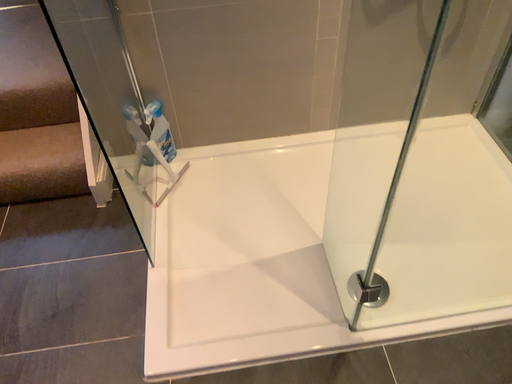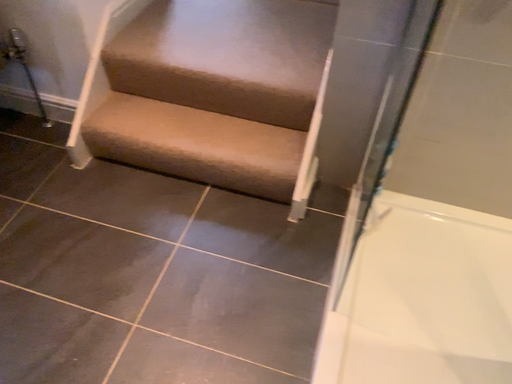
Question: Which way did the camera rotate in the video?

Choices:
 (A) rotated left
 (B) rotated right

Answer: (A)